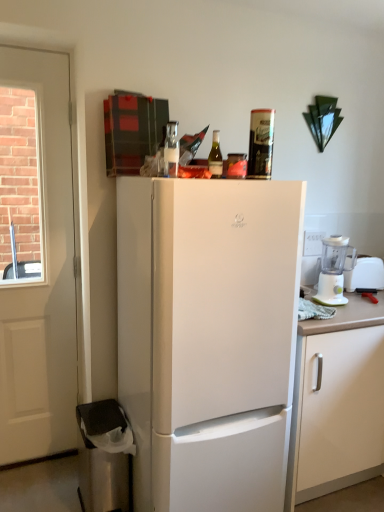
Locate an element on the screen. space that is in front of green glass bottle at top, which appears as the first bottle when viewed from the right is located at coordinates [x=211, y=177].